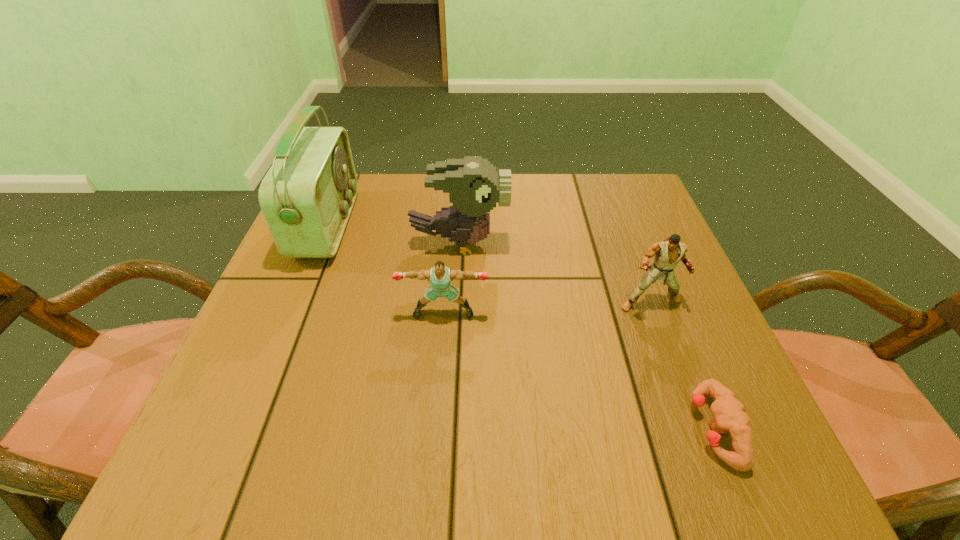
Find the location of a particular element. vacant space at the far edge of the desktop is located at coordinates (391, 218).

Identify the location of free region at the left edge of the desktop. This screenshot has width=960, height=540. (248, 339).

In the image, there is a desktop. Identify the location of vacant space at the right edge. (716, 351).

In the image, there is a desktop. What are the coordinates of `vacant space at the far right corner` in the screenshot? It's located at (636, 201).

Identify the location of free area in between the tallest puncher and the nearest object. The image size is (960, 540). (682, 365).

Where is `vacant region between the leftmost object and the fourth shortest object`? vacant region between the leftmost object and the fourth shortest object is located at coordinates (394, 234).

This screenshot has width=960, height=540. I want to click on vacant area that lies between the tallest puncher and the leftmost object, so click(x=489, y=264).

Image resolution: width=960 pixels, height=540 pixels. What are the coordinates of `free space that is in between the bird and the tallest object` in the screenshot? It's located at (394, 234).

At what (x,y) coordinates should I click in order to perform the action: click on empty location between the tallest object and the shortest object. Please return your answer as a coordinate pair (x, y). The width and height of the screenshot is (960, 540). Looking at the image, I should click on (520, 327).

Find the location of a particular element. free space between the tallest object and the second tallest puncher is located at coordinates (385, 269).